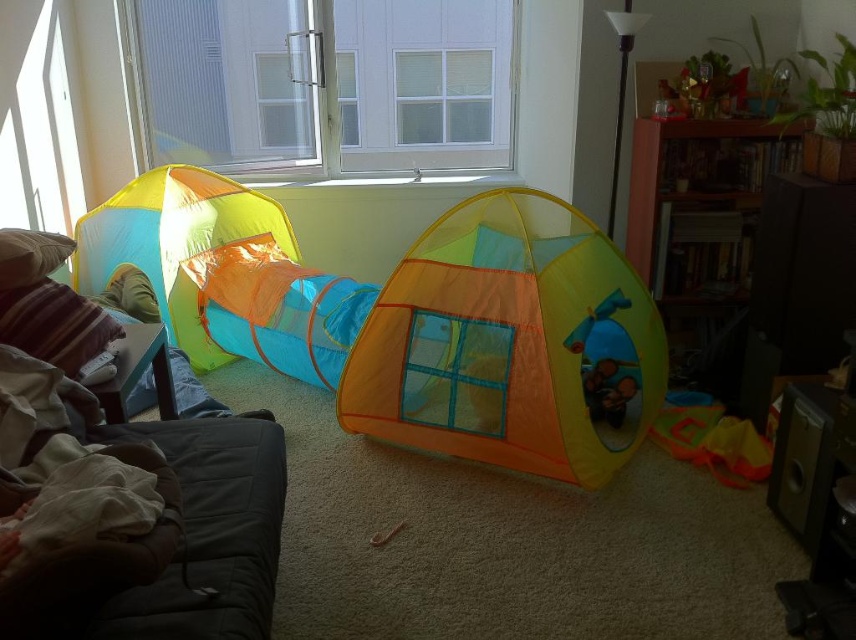
Question: Is velvet brown couch at left positioned behind translucent orange fabric play tent at center?

Choices:
 (A) no
 (B) yes

Answer: (A)

Question: Does translucent nylon tent at left have a larger size compared to translucent orange fabric play tent at center?

Choices:
 (A) yes
 (B) no

Answer: (A)

Question: Among these points, which one is farthest from the camera?

Choices:
 (A) (473, 208)
 (B) (254, 577)
 (C) (280, 248)

Answer: (C)

Question: Which is nearer to the translucent orange fabric play tent at center?

Choices:
 (A) velvet brown couch at left
 (B) translucent nylon tent at left
 (C) translucent nylon tent at center

Answer: (B)

Question: Is velvet brown couch at left to the left of translucent orange fabric play tent at center from the viewer's perspective?

Choices:
 (A) no
 (B) yes

Answer: (B)

Question: Which object is farther from the camera taking this photo?

Choices:
 (A) translucent nylon tent at center
 (B) translucent nylon tent at left
 (C) translucent orange fabric play tent at center

Answer: (B)